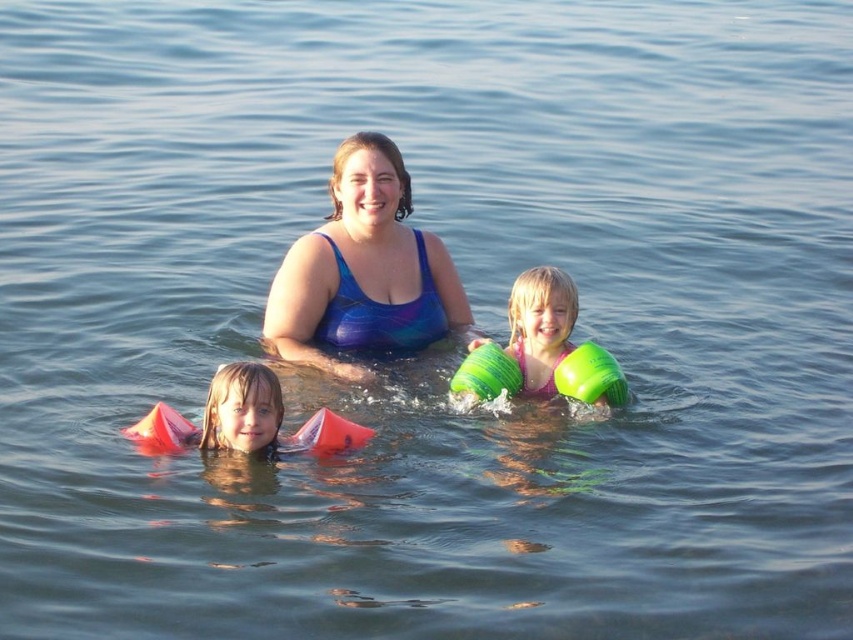
You are a lifeguard observing the scene. You notice two items in the water near the center. One is the blue shiny swimsuit at center and the other is the green rubber arm bands at center. Which item is smaller in size?

The blue shiny swimsuit at center has a smaller size compared to the green rubber arm bands at center.

You are a photographer trying to capture a clear shot of the blue shiny swimsuit at center and the matte orange floaties at lower left. Since you want both subjects to be in focus, which one should you focus on first to ensure the other is also sharp?

The matte orange floaties at lower left is behind the blue shiny swimsuit at center. To ensure both are in focus, you should focus on the matte orange floaties at lower left first because it is farther away, allowing the blue shiny swimsuit at center to also be sharp in the photo.

You are a photographer trying to capture a photo of the blue shiny swimsuit at center and the green rubber arm bands at center. Based on their positions, which object should you focus on first to ensure both are in frame?

The blue shiny swimsuit at center is located below the green rubber arm bands at center, so you should focus on the green rubber arm bands at center first to ensure both are in frame.